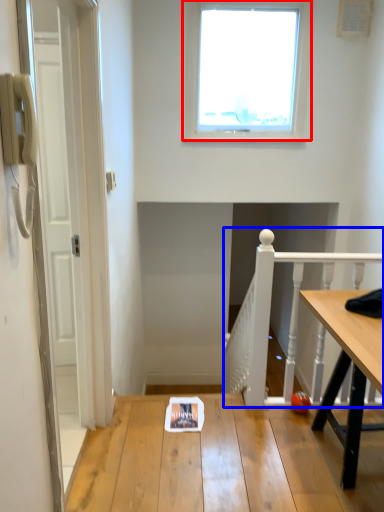
Question: Which of the following is the closest to the observer, window (highlighted by a red box) or rail (highlighted by a blue box)?

Choices:
 (A) window
 (B) rail

Answer: (B)